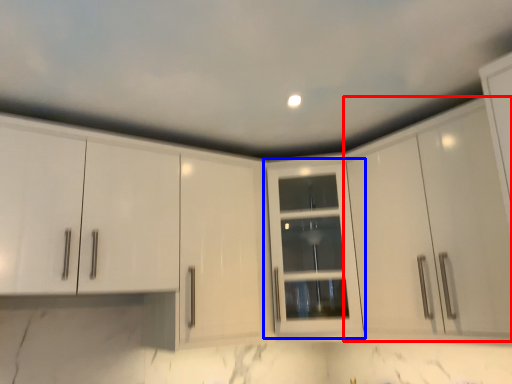
Question: Which object appears farthest to the camera in this image, cabinetry (highlighted by a red box) or cabinetry (highlighted by a blue box)?

Choices:
 (A) cabinetry
 (B) cabinetry

Answer: (B)